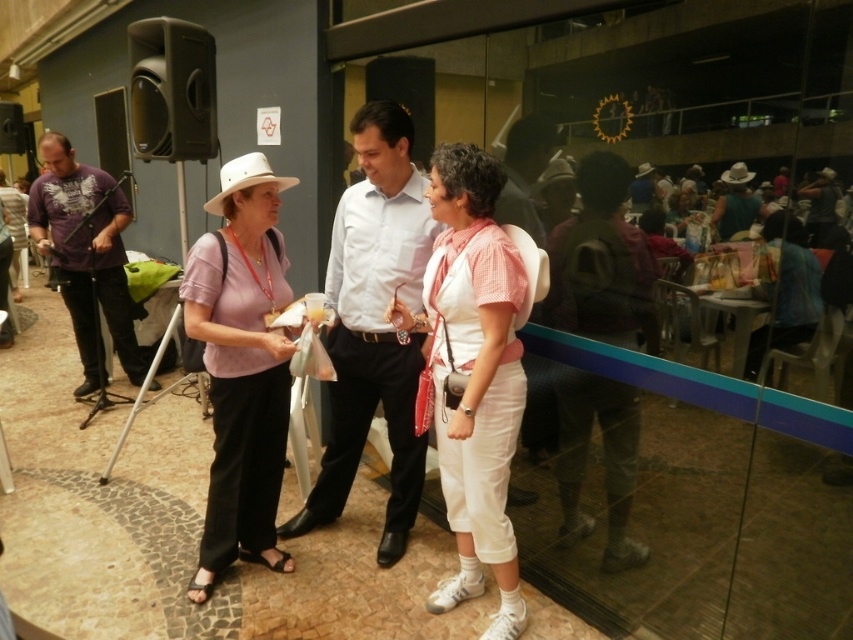
You are organizing a clothing display and need to arrange the white cotton shirt at center and the matte pink shirt at center side by side. Based on their sizes, which one should be placed on the left to ensure they fit within a 1.5 meter wide display area?

The white cotton shirt at center is wider than the matte pink shirt at center. To fit within the 1.5 meter display area, place the wider white cotton shirt at center on the left and the narrower matte pink shirt at center on the right, ensuring their combined width doesn

You are at a social event and want to know if the purple cotton shirt at left has a larger width than the matte white cowboy hat at upper right. Can you determine this based on the scene?

The purple cotton shirt at left might be wider than matte white cowboy hat at upper right, so it is possible that the purple cotton shirt at left has a larger width than the matte white cowboy hat at upper right.